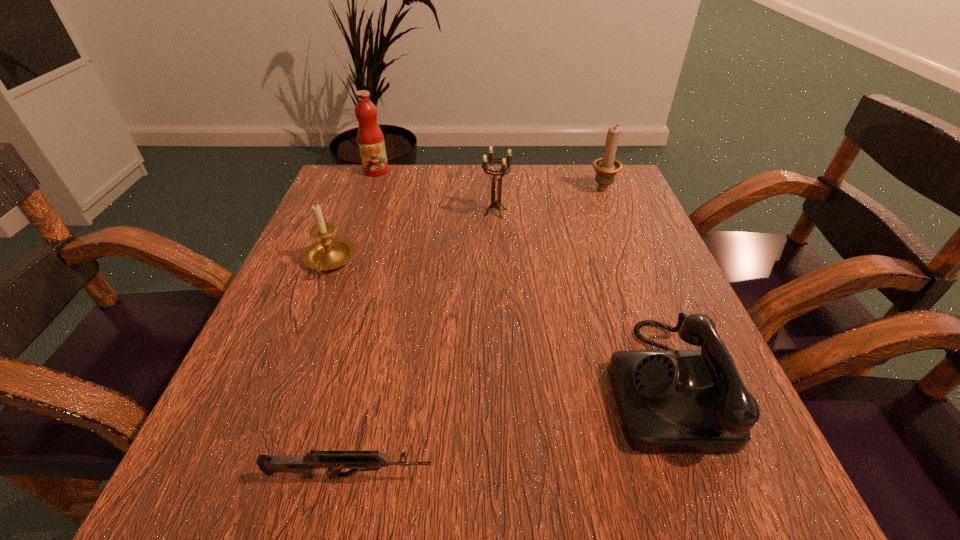
In order to click on fruit juice in this screenshot , I will do `click(370, 138)`.

Identify the location of the tallest object. (370, 138).

Where is `the second farthest object`? the second farthest object is located at coordinates [606, 168].

The width and height of the screenshot is (960, 540). In order to click on the farthest candle holder in this screenshot , I will do `click(606, 168)`.

At what (x,y) coordinates should I click in order to perform the action: click on the fourth nearest object. Please return your answer as a coordinate pair (x, y). Looking at the image, I should click on (496, 204).

I want to click on the second candle holder from right to left, so click(496, 204).

You are a GUI agent. You are given a task and a screenshot of the screen. Output one action in this format:
    pyautogui.click(x=<x>, y=<y>)
    Task: Click on the nearest candle holder
    
    Given the screenshot: What is the action you would take?
    pyautogui.click(x=329, y=253)

Locate an element on the screen. The width and height of the screenshot is (960, 540). the leftmost candle holder is located at coordinates (329, 253).

In order to click on the second nearest object in this screenshot , I will do `click(669, 401)`.

Image resolution: width=960 pixels, height=540 pixels. What are the coordinates of `the shortest object` in the screenshot? It's located at (356, 460).